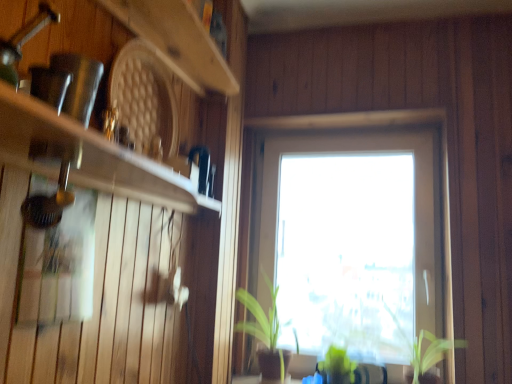
This screenshot has width=512, height=384. In order to click on green matte plant at center, placed as the first plant when sorted from left to right in this screenshot , I will do `click(265, 333)`.

The image size is (512, 384). Find the location of `green leafy plant at lower right, the 3th plant viewed from the left`. green leafy plant at lower right, the 3th plant viewed from the left is located at coordinates (425, 349).

The image size is (512, 384). I want to click on matte white shelf at left, the 2th shelf positioned from the top, so click(x=88, y=156).

Image resolution: width=512 pixels, height=384 pixels. Describe the element at coordinates (337, 366) in the screenshot. I see `green leafy plant at lower center, the 2th plant from the right` at that location.

Locate an element on the screen. The image size is (512, 384). green matte plant at center, placed as the first plant when sorted from left to right is located at coordinates (265, 333).

Considering the relative positions of green leafy plant at lower center, the second plant in the left-to-right sequence, and green leafy plant at lower right, the first plant positioned from the right, in the image provided, is green leafy plant at lower center, the second plant in the left-to-right sequence, to the right of green leafy plant at lower right, the first plant positioned from the right, from the viewer's perspective?

No.

From their relative heights in the image, would you say green leafy plant at lower center, the 2th plant from the right, is taller or shorter than green leafy plant at lower right, the first plant positioned from the right?

green leafy plant at lower center, the 2th plant from the right, is shorter than green leafy plant at lower right, the first plant positioned from the right.

Measure the distance between green leafy plant at lower center, the second plant in the left-to-right sequence, and green leafy plant at lower right, the first plant positioned from the right.

29.03 centimeters.

Based on the photo, from a real-world perspective, who is located higher, green leafy plant at lower center, the second plant in the left-to-right sequence, or green leafy plant at lower right, the first plant positioned from the right?

In real-world perspective, green leafy plant at lower right, the first plant positioned from the right, is above.

Can you confirm if green leafy plant at lower center, the 2th plant from the right, is smaller than matte white shelf at left, the first shelf in the bottom-to-top sequence?

Indeed, green leafy plant at lower center, the 2th plant from the right, has a smaller size compared to matte white shelf at left, the first shelf in the bottom-to-top sequence.

Is green leafy plant at lower center, the second plant in the left-to-right sequence, further to camera compared to matte white shelf at left, the first shelf in the bottom-to-top sequence?

That is True.

Does green leafy plant at lower center, the second plant in the left-to-right sequence, have a greater width compared to matte white shelf at left, the first shelf in the bottom-to-top sequence?

No, green leafy plant at lower center, the second plant in the left-to-right sequence, is not wider than matte white shelf at left, the first shelf in the bottom-to-top sequence.

Consider the image. Is green leafy plant at lower right, the first plant positioned from the right, spatially inside wooden at upper left, which appears as the second shelf when ordered from the bottom, or outside of it?

green leafy plant at lower right, the first plant positioned from the right, is located beyond the bounds of wooden at upper left, which appears as the second shelf when ordered from the bottom.

Could you tell me if green leafy plant at lower right, the 3th plant viewed from the left, is facing wooden at upper left, which appears as the second shelf when ordered from the bottom?

No, green leafy plant at lower right, the 3th plant viewed from the left, is not facing towards wooden at upper left, which appears as the second shelf when ordered from the bottom.

In the scene shown: From a real-world perspective, is green leafy plant at lower right, the 3th plant viewed from the left, physically below wooden at upper left, which appears as the first shelf when viewed from the top?

Yes, from a real-world perspective, green leafy plant at lower right, the 3th plant viewed from the left, is beneath wooden at upper left, which appears as the first shelf when viewed from the top.

Looking at this image, is green leafy plant at lower right, the 3th plant viewed from the left, to the left or to the right of wooden at upper left, which appears as the second shelf when ordered from the bottom, in the image?

From the image, it's evident that green leafy plant at lower right, the 3th plant viewed from the left, is to the right of wooden at upper left, which appears as the second shelf when ordered from the bottom.

Can you tell me how much wooden at upper left, which appears as the first shelf when viewed from the top, and matte white shelf at left, the 2th shelf positioned from the top, differ in facing direction?

The angular difference between wooden at upper left, which appears as the first shelf when viewed from the top, and matte white shelf at left, the 2th shelf positioned from the top, is 0.356 degrees.

Which is farther, (212, 57) or (155, 184)?

Point (212, 57)

Is wooden at upper left, which appears as the first shelf when viewed from the top, facing towards matte white shelf at left, the first shelf in the bottom-to-top sequence?

No, wooden at upper left, which appears as the first shelf when viewed from the top, is not oriented towards matte white shelf at left, the first shelf in the bottom-to-top sequence.

Where is `shelf lying below the wooden at upper left, which appears as the first shelf when viewed from the top (from the image's perspective)`? shelf lying below the wooden at upper left, which appears as the first shelf when viewed from the top (from the image's perspective) is located at coordinates (88, 156).

From the image's perspective, which is below, green matte plant at center, which ranks as the third plant in right-to-left order, or matte white shelf at left, the 2th shelf positioned from the top?

green matte plant at center, which ranks as the third plant in right-to-left order.

Between point (288, 323) and point (118, 178), which one is positioned behind?

Positioned behind is point (288, 323).

Where is `the 1st shelf above when counting from the green matte plant at center, which ranks as the third plant in right-to-left order (from the image's perspective)`? The image size is (512, 384). the 1st shelf above when counting from the green matte plant at center, which ranks as the third plant in right-to-left order (from the image's perspective) is located at coordinates (88, 156).

From a real-world perspective, is green matte plant at center, placed as the first plant when sorted from left to right, over matte white shelf at left, the first shelf in the bottom-to-top sequence?

No.

Is point (442, 146) positioned behind point (147, 26)?

Yes, it is.

From a real-world perspective, which is physically below, transparent glass window at center or wooden at upper left, which appears as the first shelf when viewed from the top?

From a 3D spatial view, transparent glass window at center is below.

Which of these two, transparent glass window at center or wooden at upper left, which appears as the first shelf when viewed from the top, stands shorter?

wooden at upper left, which appears as the first shelf when viewed from the top.

Is transparent glass window at center positioned beyond the bounds of wooden at upper left, which appears as the first shelf when viewed from the top?

Yes, transparent glass window at center is outside of wooden at upper left, which appears as the first shelf when viewed from the top.

Which of these two, wooden at upper left, which appears as the first shelf when viewed from the top, or green matte plant at center, placed as the first plant when sorted from left to right, is wider?

green matte plant at center, placed as the first plant when sorted from left to right, is wider.

Which is behind, wooden at upper left, which appears as the second shelf when ordered from the bottom, or green matte plant at center, which ranks as the third plant in right-to-left order?

green matte plant at center, which ranks as the third plant in right-to-left order.

From a real-world perspective, is wooden at upper left, which appears as the second shelf when ordered from the bottom, below green matte plant at center, placed as the first plant when sorted from left to right?

Incorrect, from a real-world perspective, wooden at upper left, which appears as the second shelf when ordered from the bottom, is higher than green matte plant at center, placed as the first plant when sorted from left to right.

Considering the relative sizes of wooden at upper left, which appears as the second shelf when ordered from the bottom, and green matte plant at center, which ranks as the third plant in right-to-left order, in the image provided, is wooden at upper left, which appears as the second shelf when ordered from the bottom, smaller than green matte plant at center, which ranks as the third plant in right-to-left order,?

Yes, wooden at upper left, which appears as the second shelf when ordered from the bottom, is smaller than green matte plant at center, which ranks as the third plant in right-to-left order.

From the green leafy plant at lower center, the second plant in the left-to-right sequence, count 2nd plants forward and point to it. Please provide its 2D coordinates.

[(425, 349)]

From a real-world perspective, count 1st shelfs upward from the green leafy plant at lower center, the second plant in the left-to-right sequence, and point to it. Please provide its 2D coordinates.

[(88, 156)]

Estimate the real-world distances between objects in this image. Which object is closer to green matte plant at center, which ranks as the third plant in right-to-left order, transparent glass window at center or green leafy plant at lower center, the 2th plant from the right?

Among the two, green leafy plant at lower center, the 2th plant from the right, is located nearer to green matte plant at center, which ranks as the third plant in right-to-left order.

In the scene shown: Which object lies nearer to the anchor point green leafy plant at lower right, the 3th plant viewed from the left, green leafy plant at lower center, the second plant in the left-to-right sequence, or transparent glass window at center?

Based on the image, green leafy plant at lower center, the second plant in the left-to-right sequence, appears to be nearer to green leafy plant at lower right, the 3th plant viewed from the left.

Considering their positions, is green matte plant at center, which ranks as the third plant in right-to-left order, positioned further to wooden at upper left, which appears as the second shelf when ordered from the bottom, than green leafy plant at lower center, the second plant in the left-to-right sequence?

Among the two, green leafy plant at lower center, the second plant in the left-to-right sequence, is located further to wooden at upper left, which appears as the second shelf when ordered from the bottom.

Looking at the image, which one is located further to green leafy plant at lower center, the 2th plant from the right, matte white shelf at left, the first shelf in the bottom-to-top sequence, or green leafy plant at lower right, the 3th plant viewed from the left?

matte white shelf at left, the first shelf in the bottom-to-top sequence, is further to green leafy plant at lower center, the 2th plant from the right.

Looking at the image, which one is located closer to green leafy plant at lower right, the first plant positioned from the right, green leafy plant at lower center, the second plant in the left-to-right sequence, or wooden at upper left, which appears as the second shelf when ordered from the bottom?

green leafy plant at lower center, the second plant in the left-to-right sequence, is closer to green leafy plant at lower right, the first plant positioned from the right.

From the image, which object appears to be farther from green leafy plant at lower center, the second plant in the left-to-right sequence, green matte plant at center, placed as the first plant when sorted from left to right, or wooden at upper left, which appears as the first shelf when viewed from the top?

wooden at upper left, which appears as the first shelf when viewed from the top, is further to green leafy plant at lower center, the second plant in the left-to-right sequence.

From the picture: When comparing their distances from transparent glass window at center, does green leafy plant at lower center, the second plant in the left-to-right sequence, or green leafy plant at lower right, the 3th plant viewed from the left, seem further?

green leafy plant at lower center, the second plant in the left-to-right sequence, lies further to transparent glass window at center than the other object.

When comparing their distances from transparent glass window at center, does matte white shelf at left, the first shelf in the bottom-to-top sequence, or green leafy plant at lower right, the first plant positioned from the right, seem closer?

Among the two, green leafy plant at lower right, the first plant positioned from the right, is located nearer to transparent glass window at center.

Locate an element on the screen. The width and height of the screenshot is (512, 384). shelf between wooden at upper left, which appears as the first shelf when viewed from the top, and green leafy plant at lower right, the first plant positioned from the right, from top to bottom is located at coordinates (88, 156).

Locate an element on the screen. shelf located between matte white shelf at left, the first shelf in the bottom-to-top sequence, and transparent glass window at center in the depth direction is located at coordinates (177, 41).

Where is `window between green matte plant at center, placed as the first plant when sorted from left to right, and green leafy plant at lower right, the first plant positioned from the right, in the horizontal direction`? Image resolution: width=512 pixels, height=384 pixels. window between green matte plant at center, placed as the first plant when sorted from left to right, and green leafy plant at lower right, the first plant positioned from the right, in the horizontal direction is located at coordinates pos(383,128).

This screenshot has width=512, height=384. I want to click on shelf positioned between matte white shelf at left, the first shelf in the bottom-to-top sequence, and green matte plant at center, which ranks as the third plant in right-to-left order, from near to far, so click(x=177, y=41).